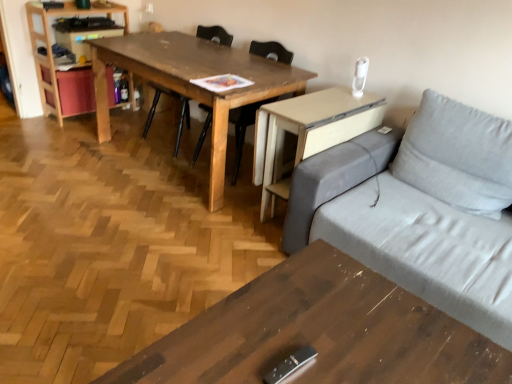
Question: Considering the relative sizes of wooden coffee table at lower center, which ranks as the 2th table in top-to-bottom order, and wooden chair at center, the first chair when ordered from left to right, in the image provided, is wooden coffee table at lower center, which ranks as the 2th table in top-to-bottom order, taller than wooden chair at center, the first chair when ordered from left to right,?

Choices:
 (A) yes
 (B) no

Answer: (B)

Question: Is wooden coffee table at lower center, which ranks as the 2th table in top-to-bottom order, positioned far away from wooden chair at center, the second chair in the right-to-left sequence?

Choices:
 (A) yes
 (B) no

Answer: (A)

Question: Is wooden coffee table at lower center, the 1th table viewed from the front, facing away from wooden chair at center, the first chair when ordered from left to right?

Choices:
 (A) no
 (B) yes

Answer: (A)

Question: From a real-world perspective, is wooden coffee table at lower center, which ranks as the 2th table in top-to-bottom order, below wooden chair at center, the second chair in the right-to-left sequence?

Choices:
 (A) yes
 (B) no

Answer: (A)

Question: Considering the relative sizes of wooden coffee table at lower center, which ranks as the 2th table in top-to-bottom order, and wooden chair at center, the second chair in the right-to-left sequence, in the image provided, is wooden coffee table at lower center, which ranks as the 2th table in top-to-bottom order, smaller than wooden chair at center, the second chair in the right-to-left sequence,?

Choices:
 (A) yes
 (B) no

Answer: (B)

Question: Does point (229, 66) appear closer or farther from the camera than point (166, 89)?

Choices:
 (A) closer
 (B) farther

Answer: (B)

Question: Considering the relative positions of wooden table at center, the first table viewed from the top, and wooden chair at center, the first chair when ordered from left to right, in the image provided, is wooden table at center, the first table viewed from the top, to the left or to the right of wooden chair at center, the first chair when ordered from left to right,?

Choices:
 (A) left
 (B) right

Answer: (B)

Question: Is wooden table at center, the first table viewed from the top, inside or outside of wooden chair at center, the second chair in the right-to-left sequence?

Choices:
 (A) outside
 (B) inside

Answer: (A)

Question: In terms of height, does wooden table at center, acting as the first table starting from the back, look taller or shorter compared to wooden chair at center, the first chair when ordered from left to right?

Choices:
 (A) tall
 (B) short

Answer: (B)

Question: Is light wood bookshelf at left to the left or to the right of wooden chair at center, the first chair when ordered from left to right, in the image?

Choices:
 (A) right
 (B) left

Answer: (B)

Question: Does point (72, 1) appear closer or farther from the camera than point (184, 117)?

Choices:
 (A) closer
 (B) farther

Answer: (A)

Question: In terms of height, does light wood bookshelf at left look taller or shorter compared to wooden chair at center, the first chair when ordered from left to right?

Choices:
 (A) tall
 (B) short

Answer: (A)

Question: Looking at the image, does light wood bookshelf at left seem bigger or smaller compared to wooden chair at center, the second chair in the right-to-left sequence?

Choices:
 (A) small
 (B) big

Answer: (A)

Question: In terms of size, does wooden chair at center, the second chair in the right-to-left sequence, appear bigger or smaller than wooden table at center, which is counted as the 2th table, starting from the bottom?

Choices:
 (A) small
 (B) big

Answer: (A)

Question: From the image's perspective, is wooden chair at center, the second chair in the right-to-left sequence, above or below wooden table at center, the first table viewed from the top?

Choices:
 (A) above
 (B) below

Answer: (A)